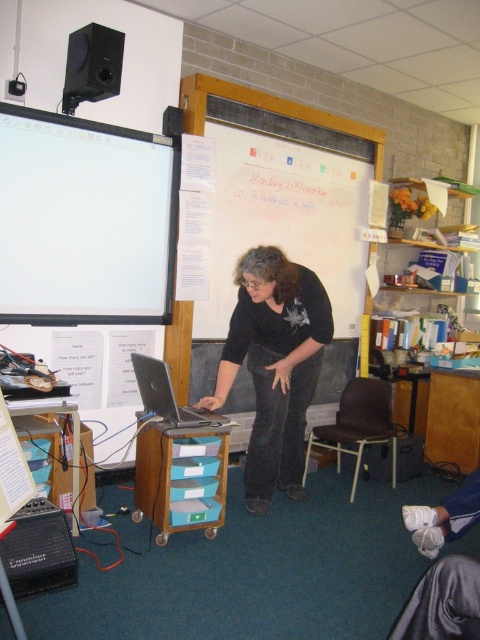
Question: Does whiteboard at upper center appear on the right side of black matte speaker at upper left?

Choices:
 (A) yes
 (B) no

Answer: (A)

Question: Which point is closer to the camera?

Choices:
 (A) white glossy projector screen at upper left
 (B) black matte/black jeans at center
 (C) black matte speaker at upper left
 (D) silver metallic laptop at center

Answer: (D)

Question: Which point is closer to the camera?

Choices:
 (A) black matte/black jeans at center
 (B) white fabric gloves at lower right
 (C) whiteboard at upper center
 (D) black matte speaker at upper left

Answer: (B)

Question: Considering the relative positions of whiteboard at upper center and black matte/black jeans at center in the image provided, where is whiteboard at upper center located with respect to black matte/black jeans at center?

Choices:
 (A) below
 (B) above

Answer: (B)

Question: Which point appears closest to the camera in this image?

Choices:
 (A) (79, 100)
 (B) (417, 540)

Answer: (B)

Question: Does white glossy projector screen at upper left appear on the right side of white fabric gloves at lower right?

Choices:
 (A) yes
 (B) no

Answer: (B)